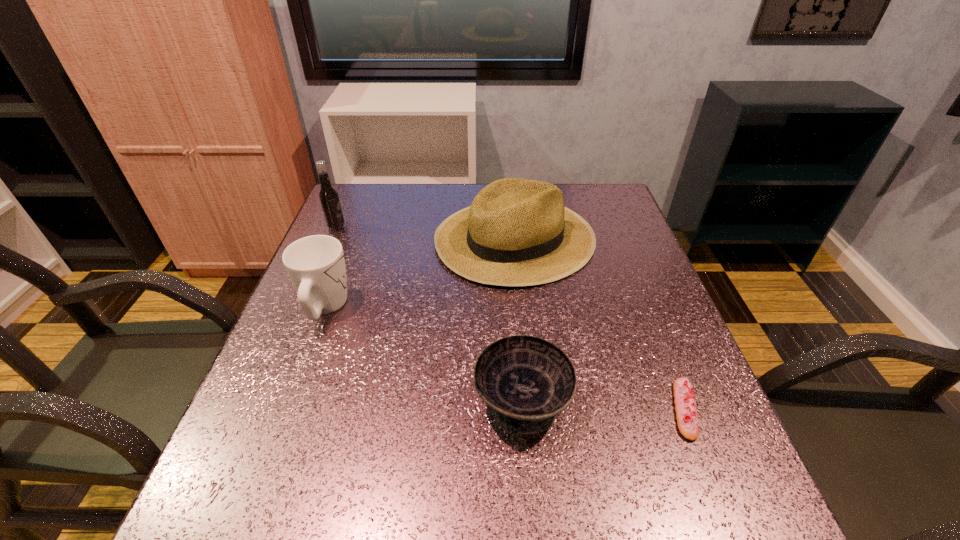
The image size is (960, 540). What are the coordinates of `root beer` in the screenshot? It's located at (328, 196).

At what (x,y) coordinates should I click in order to perform the action: click on sunhat. Please return your answer as a coordinate pair (x, y). The image size is (960, 540). Looking at the image, I should click on (517, 232).

Where is `mug`? mug is located at coordinates (315, 264).

Image resolution: width=960 pixels, height=540 pixels. In order to click on the fourth tallest object in this screenshot , I will do `click(527, 381)`.

Locate an element on the screen. eclair is located at coordinates (685, 404).

What are the coordinates of `the rightmost object` in the screenshot? It's located at (685, 404).

Image resolution: width=960 pixels, height=540 pixels. Find the location of `free location located 0.190m on the label of the tallest object`. free location located 0.190m on the label of the tallest object is located at coordinates (414, 227).

Locate an element on the screen. The image size is (960, 540). vacant space located 0.270m on the left of the sunhat is located at coordinates (334, 238).

The image size is (960, 540). I want to click on vacant space located 0.200m on the side of the mug with the handle, so click(352, 234).

Locate an element on the screen. vacant point located 0.120m on the side of the mug with the handle is located at coordinates (346, 253).